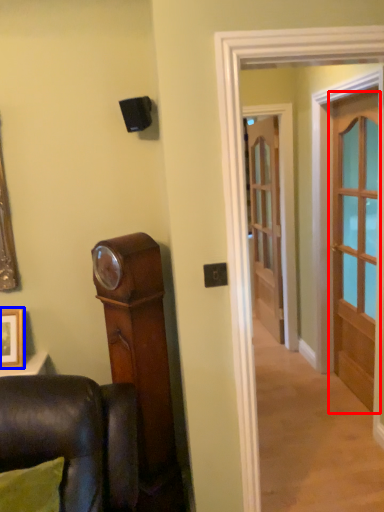
Question: Which point is closer to the camera, door (highlighted by a red box) or picture frame (highlighted by a blue box)?

Choices:
 (A) door
 (B) picture frame

Answer: (B)